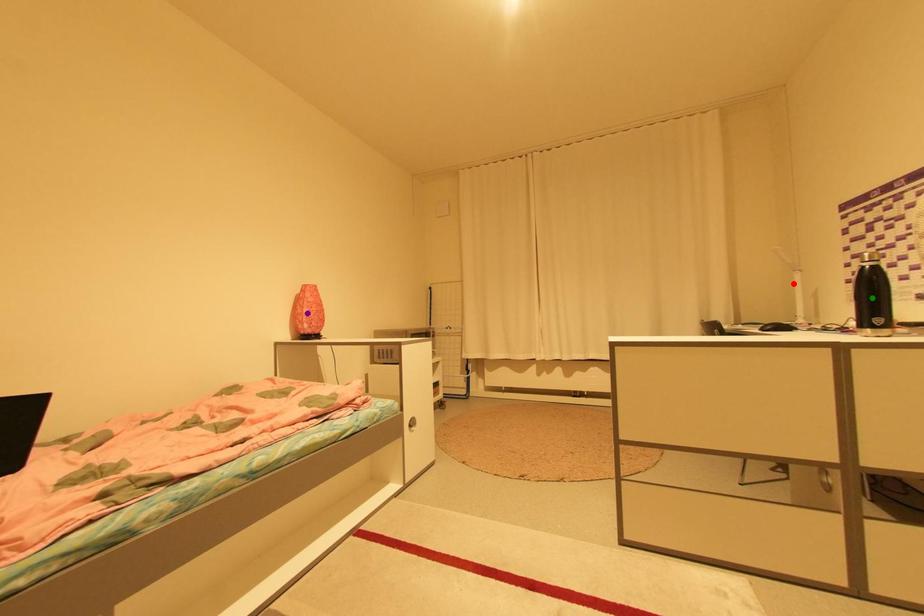
Order these from nearest to farthest:
1. purple point
2. green point
3. red point

purple point < red point < green point